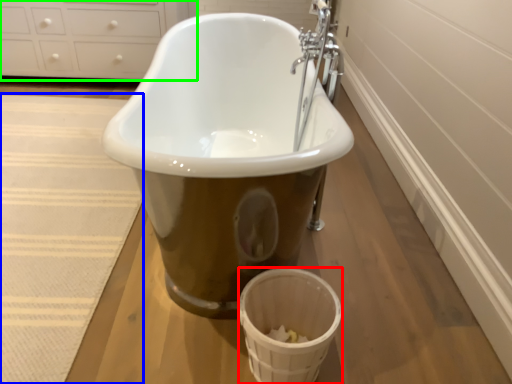
Question: Estimate the real-world distances between objects in this image. Which object is closer to basket (highlighted by a red box), bath mat (highlighted by a blue box) or cabinetry (highlighted by a green box)?

Choices:
 (A) bath mat
 (B) cabinetry

Answer: (A)